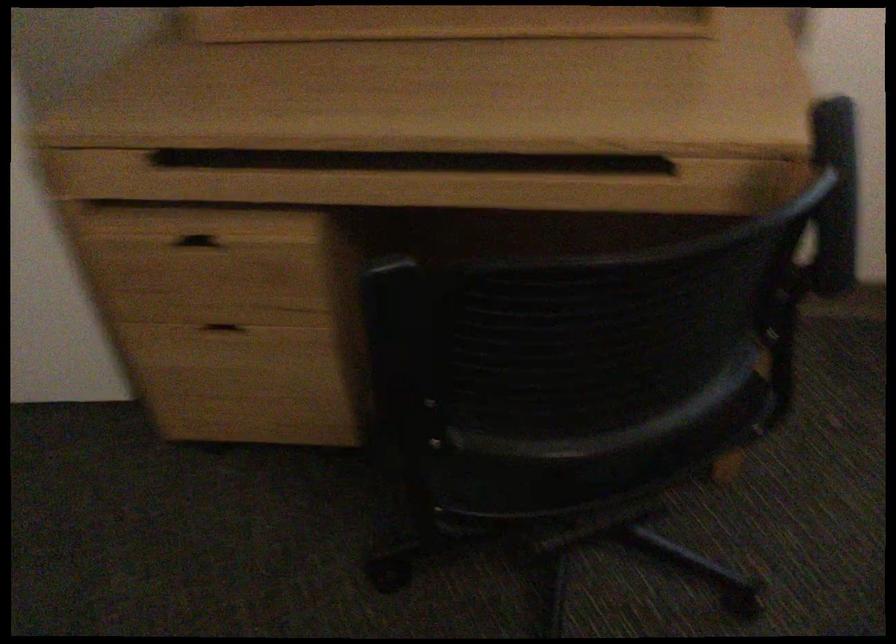
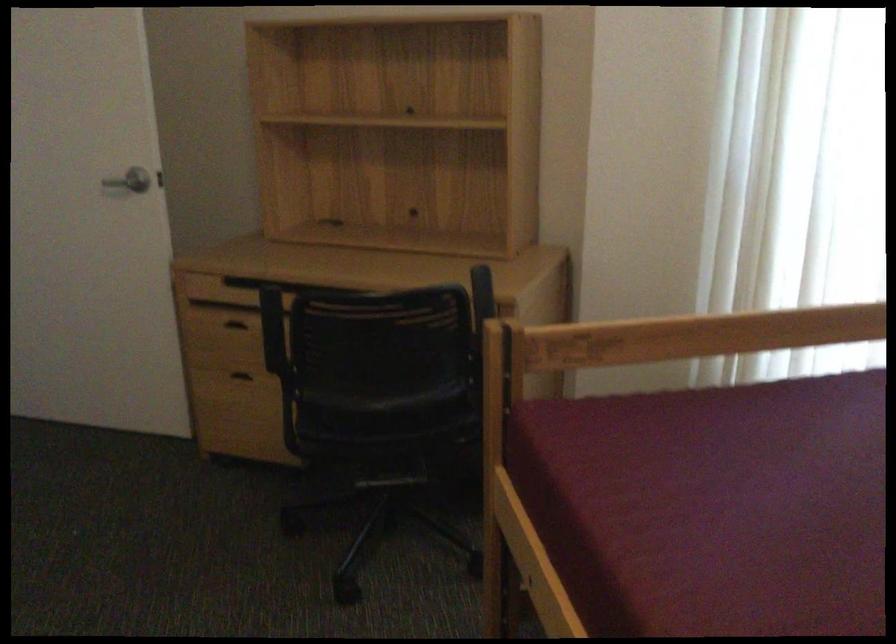
Where in the second image is the point corresponding to the point at 400,364 from the first image?

(273, 333)